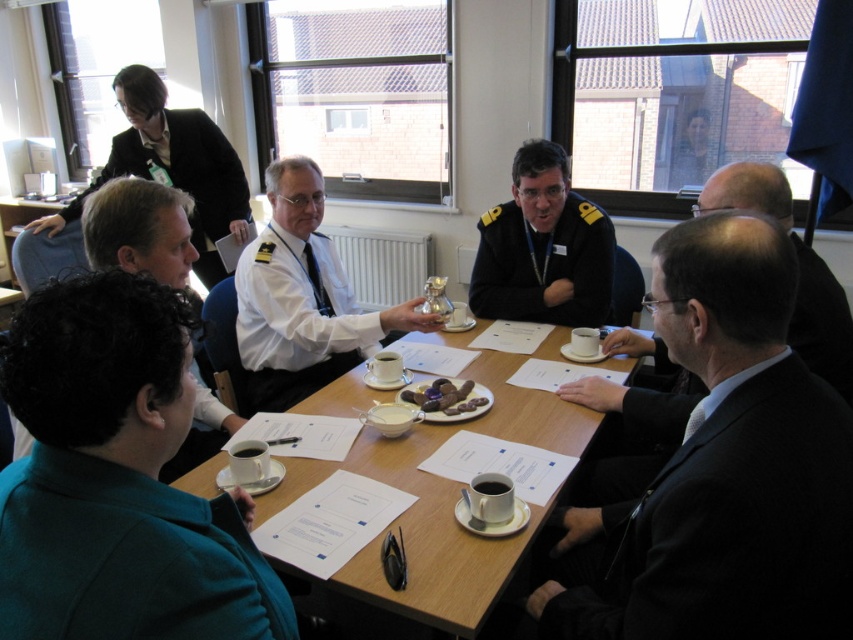
You are standing in the meeting room and want to place a new object between the two points, point(x=511, y=269) and point(x=218, y=225). Based on their positions, which point is closer to you, so you can start placing the object from there?

Point(x=511, y=269) is closer to the viewer than point(x=218, y=225), so you should start placing the object from point(x=511, y=269) since it is nearer to your current position.

You are a guest attending a meeting and need to find the host. The host is wearing a dark blue uniform at center. Which direction should you look relative to the black uniform at upper left?

The dark blue uniform at center is positioned on the right side of the black uniform at upper left, so you should look to the right relative to the black uniform at upper left to find the host.

You are a photographer trying to capture a group photo of the meeting participants. You notice the black uniform at upper left and the white uniform at upper center. Which uniform should you adjust in your framing to ensure both uniforms are equally visible in the photo?

Since the black uniform at upper left is wider than the white uniform at upper center, you should adjust the framing to give more space to the white uniform at upper center so both uniforms appear equally visible in the photo.